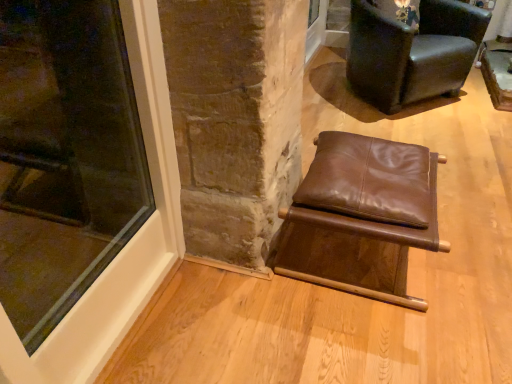
Identify the location of free space in front of brown leather stool at center, marked as the 2th chair in a back-to-front arrangement. (374, 336).